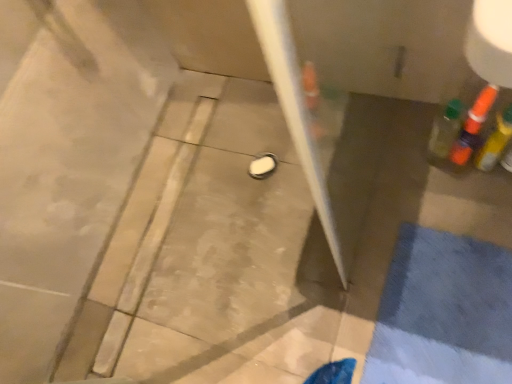
This screenshot has width=512, height=384. What do you see at coordinates (472, 127) in the screenshot?
I see `translucent orange bottle at upper right, the second bottle when ordered from right to left` at bounding box center [472, 127].

What do you see at coordinates (445, 131) in the screenshot?
I see `translucent plastic bottle at right, the third bottle positioned from the right` at bounding box center [445, 131].

Find the location of a particular element. Image resolution: width=512 pixels, height=384 pixels. translucent orange bottle at right, which appears as the 1th bottle when viewed from the right is located at coordinates (495, 141).

From the image's perspective, is translucent orange bottle at upper right, the second bottle when ordered from right to left, beneath translucent plastic bottle at right, the third bottle positioned from the right?

No.

Which is correct: translucent orange bottle at upper right, placed as the 2th bottle when sorted from left to right, is inside translucent plastic bottle at right, the third bottle positioned from the right, or outside of it?

translucent orange bottle at upper right, placed as the 2th bottle when sorted from left to right, is located beyond the bounds of translucent plastic bottle at right, the third bottle positioned from the right.

Which is in front, point (470, 129) or point (453, 142)?

The point (470, 129) is closer.

Is translucent orange bottle at right, arranged as the 3th bottle when viewed from the left, oriented towards translucent orange bottle at upper right, the second bottle when ordered from right to left?

No.

Are translucent orange bottle at right, arranged as the 3th bottle when viewed from the left, and translucent orange bottle at upper right, placed as the 2th bottle when sorted from left to right, located far from each other?

That's not correct — translucent orange bottle at right, arranged as the 3th bottle when viewed from the left, is a little close to translucent orange bottle at upper right, placed as the 2th bottle when sorted from left to right.

From a real-world perspective, is translucent orange bottle at right, arranged as the 3th bottle when viewed from the left, physically located above or below translucent orange bottle at upper right, placed as the 2th bottle when sorted from left to right?

In terms of real-world spatial position, translucent orange bottle at right, arranged as the 3th bottle when viewed from the left, is above translucent orange bottle at upper right, placed as the 2th bottle when sorted from left to right.

Is point (487, 162) farther from viewer compared to point (471, 117)?

Yes, it is.

Looking at this image, is translucent orange bottle at right, which appears as the 1th bottle when viewed from the right, at the back of translucent orange bottle at upper right, placed as the 2th bottle when sorted from left to right?

No, translucent orange bottle at upper right, placed as the 2th bottle when sorted from left to right, is not facing the opposite direction of translucent orange bottle at right, which appears as the 1th bottle when viewed from the right.

How distant is translucent orange bottle at upper right, placed as the 2th bottle when sorted from left to right, from translucent orange bottle at right, which appears as the 1th bottle when viewed from the right?

A distance of 2.05 inches exists between translucent orange bottle at upper right, placed as the 2th bottle when sorted from left to right, and translucent orange bottle at right, which appears as the 1th bottle when viewed from the right.

Considering the sizes of objects translucent orange bottle at upper right, placed as the 2th bottle when sorted from left to right, and translucent orange bottle at right, arranged as the 3th bottle when viewed from the left, in the image provided, who is wider, translucent orange bottle at upper right, placed as the 2th bottle when sorted from left to right, or translucent orange bottle at right, arranged as the 3th bottle when viewed from the left,?

Wider between the two is translucent orange bottle at upper right, placed as the 2th bottle when sorted from left to right.

Considering their positions, is translucent orange bottle at upper right, placed as the 2th bottle when sorted from left to right, located in front of or behind translucent orange bottle at right, which appears as the 1th bottle when viewed from the right?

translucent orange bottle at upper right, placed as the 2th bottle when sorted from left to right, is behind translucent orange bottle at right, which appears as the 1th bottle when viewed from the right.

Which is correct: translucent plastic bottle at right, the third bottle positioned from the right, is inside translucent orange bottle at upper right, the second bottle when ordered from right to left, or outside of it?

translucent plastic bottle at right, the third bottle positioned from the right, is spatially situated outside translucent orange bottle at upper right, the second bottle when ordered from right to left.

How different are the orientations of translucent plastic bottle at right, the third bottle positioned from the right, and translucent orange bottle at upper right, placed as the 2th bottle when sorted from left to right, in degrees?

The angular difference between translucent plastic bottle at right, the third bottle positioned from the right, and translucent orange bottle at upper right, placed as the 2th bottle when sorted from left to right, is 8.96 degrees.

In the scene shown: Are translucent plastic bottle at right, which is counted as the first bottle, starting from the left, and translucent orange bottle at upper right, placed as the 2th bottle when sorted from left to right, beside each other?

Yes, translucent plastic bottle at right, which is counted as the first bottle, starting from the left, is next to translucent orange bottle at upper right, placed as the 2th bottle when sorted from left to right.

Considering the sizes of objects translucent plastic bottle at right, the third bottle positioned from the right, and translucent orange bottle at upper right, the second bottle when ordered from right to left, in the image provided, who is taller, translucent plastic bottle at right, the third bottle positioned from the right, or translucent orange bottle at upper right, the second bottle when ordered from right to left,?

translucent orange bottle at upper right, the second bottle when ordered from right to left.

Considering the positions of objects translucent orange bottle at right, arranged as the 3th bottle when viewed from the left, and translucent plastic bottle at right, which is counted as the first bottle, starting from the left, in the image provided, who is behind, translucent orange bottle at right, arranged as the 3th bottle when viewed from the left, or translucent plastic bottle at right, which is counted as the first bottle, starting from the left,?

translucent plastic bottle at right, which is counted as the first bottle, starting from the left.

Is translucent orange bottle at right, which appears as the 1th bottle when viewed from the right, positioned far away from translucent plastic bottle at right, which is counted as the first bottle, starting from the left?

translucent orange bottle at right, which appears as the 1th bottle when viewed from the right, is near translucent plastic bottle at right, which is counted as the first bottle, starting from the left, not far away.

From a real-world perspective, is translucent orange bottle at right, which appears as the 1th bottle when viewed from the right, on translucent plastic bottle at right, the third bottle positioned from the right?

Actually, translucent orange bottle at right, which appears as the 1th bottle when viewed from the right, is physically below translucent plastic bottle at right, the third bottle positioned from the right, in the real world.

Is translucent orange bottle at right, which appears as the 1th bottle when viewed from the right, to the left of translucent plastic bottle at right, the third bottle positioned from the right, from the viewer's perspective?

Incorrect, translucent orange bottle at right, which appears as the 1th bottle when viewed from the right, is not on the left side of translucent plastic bottle at right, the third bottle positioned from the right.

Considering the sizes of translucent plastic bottle at right, the third bottle positioned from the right, and translucent orange bottle at right, arranged as the 3th bottle when viewed from the left, in the image, is translucent plastic bottle at right, the third bottle positioned from the right, bigger or smaller than translucent orange bottle at right, arranged as the 3th bottle when viewed from the left,?

translucent plastic bottle at right, the third bottle positioned from the right, is smaller than translucent orange bottle at right, arranged as the 3th bottle when viewed from the left.

From a real-world perspective, is translucent plastic bottle at right, the third bottle positioned from the right, over translucent orange bottle at right, arranged as the 3th bottle when viewed from the left?

Correct, in the physical world, translucent plastic bottle at right, the third bottle positioned from the right, is higher than translucent orange bottle at right, arranged as the 3th bottle when viewed from the left.

In the scene shown: Is translucent plastic bottle at right, which is counted as the first bottle, starting from the left, not inside translucent orange bottle at right, which appears as the 1th bottle when viewed from the right?

Absolutely, translucent plastic bottle at right, which is counted as the first bottle, starting from the left, is external to translucent orange bottle at right, which appears as the 1th bottle when viewed from the right.

Can you confirm if translucent plastic bottle at right, the third bottle positioned from the right, is positioned to the left of translucent orange bottle at right, arranged as the 3th bottle when viewed from the left?

Indeed, translucent plastic bottle at right, the third bottle positioned from the right, is positioned on the left side of translucent orange bottle at right, arranged as the 3th bottle when viewed from the left.

The width and height of the screenshot is (512, 384). In order to click on the 1st bottle to the right when counting from the translucent plastic bottle at right, which is counted as the first bottle, starting from the left in this screenshot , I will do `click(472, 127)`.

Starting from the translucent orange bottle at right, which appears as the 1th bottle when viewed from the right, which bottle is the 1st one to the left? Please provide its 2D coordinates.

[(472, 127)]

Looking at the image, which one is located further to translucent orange bottle at right, arranged as the 3th bottle when viewed from the left, translucent orange bottle at upper right, the second bottle when ordered from right to left, or translucent plastic bottle at right, the third bottle positioned from the right?

translucent plastic bottle at right, the third bottle positioned from the right, lies further to translucent orange bottle at right, arranged as the 3th bottle when viewed from the left, than the other object.

Looking at the image, which one is located further to translucent orange bottle at upper right, the second bottle when ordered from right to left, translucent plastic bottle at right, which is counted as the first bottle, starting from the left, or translucent orange bottle at right, which appears as the 1th bottle when viewed from the right?

The object further to translucent orange bottle at upper right, the second bottle when ordered from right to left, is translucent plastic bottle at right, which is counted as the first bottle, starting from the left.

Based on their spatial positions, is translucent plastic bottle at right, which is counted as the first bottle, starting from the left, or translucent orange bottle at upper right, placed as the 2th bottle when sorted from left to right, closer to translucent orange bottle at right, which appears as the 1th bottle when viewed from the right?

translucent orange bottle at upper right, placed as the 2th bottle when sorted from left to right, is positioned closer to the anchor translucent orange bottle at right, which appears as the 1th bottle when viewed from the right.

Considering their positions, is translucent orange bottle at right, which appears as the 1th bottle when viewed from the right, positioned closer to translucent plastic bottle at right, the third bottle positioned from the right, than translucent orange bottle at upper right, placed as the 2th bottle when sorted from left to right?

translucent orange bottle at upper right, placed as the 2th bottle when sorted from left to right, lies closer to translucent plastic bottle at right, the third bottle positioned from the right, than the other object.

Considering their positions, is translucent orange bottle at upper right, placed as the 2th bottle when sorted from left to right, positioned closer to translucent plastic bottle at right, which is counted as the first bottle, starting from the left, than translucent orange bottle at right, which appears as the 1th bottle when viewed from the right?

translucent orange bottle at upper right, placed as the 2th bottle when sorted from left to right, is positioned closer to the anchor translucent plastic bottle at right, which is counted as the first bottle, starting from the left.

Looking at the image, which one is located closer to translucent orange bottle at upper right, placed as the 2th bottle when sorted from left to right, translucent orange bottle at right, which appears as the 1th bottle when viewed from the right, or translucent plastic bottle at right, which is counted as the first bottle, starting from the left?

The object closer to translucent orange bottle at upper right, placed as the 2th bottle when sorted from left to right, is translucent orange bottle at right, which appears as the 1th bottle when viewed from the right.

Where is `bottle between translucent plastic bottle at right, the third bottle positioned from the right, and translucent orange bottle at right, arranged as the 3th bottle when viewed from the left, from left to right`? Image resolution: width=512 pixels, height=384 pixels. bottle between translucent plastic bottle at right, the third bottle positioned from the right, and translucent orange bottle at right, arranged as the 3th bottle when viewed from the left, from left to right is located at coordinates (472, 127).